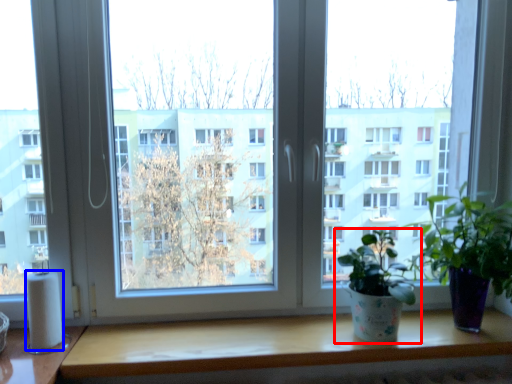
Question: Which object appears closest to the camera in this image, houseplant (highlighted by a red box) or toilet paper (highlighted by a blue box)?

Choices:
 (A) houseplant
 (B) toilet paper

Answer: (A)